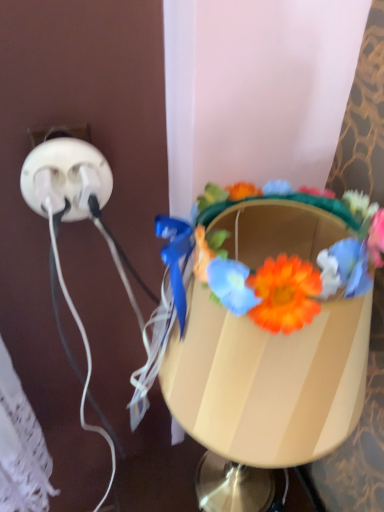
Question: From a real-world perspective, is floral crown at center on top of matte plastic table lamp at center?

Choices:
 (A) yes
 (B) no

Answer: (A)

Question: Considering the relative sizes of floral crown at center and matte plastic table lamp at center in the image provided, is floral crown at center smaller than matte plastic table lamp at center?

Choices:
 (A) no
 (B) yes

Answer: (B)

Question: Is floral crown at center oriented towards matte plastic table lamp at center?

Choices:
 (A) yes
 (B) no

Answer: (A)

Question: Is floral crown at center to the right of matte plastic table lamp at center from the viewer's perspective?

Choices:
 (A) no
 (B) yes

Answer: (B)

Question: Is floral crown at center wider than matte plastic table lamp at center?

Choices:
 (A) no
 (B) yes

Answer: (A)

Question: Is floral crown at center shorter than matte plastic table lamp at center?

Choices:
 (A) no
 (B) yes

Answer: (B)

Question: Is white plastic power plugs at left positioned beyond the bounds of floral crown at center?

Choices:
 (A) yes
 (B) no

Answer: (A)

Question: Can you confirm if white plastic power plugs at left is thinner than floral crown at center?

Choices:
 (A) yes
 (B) no

Answer: (A)

Question: Is white plastic power plugs at left oriented towards floral crown at center?

Choices:
 (A) no
 (B) yes

Answer: (A)

Question: Does white plastic power plugs at left touch floral crown at center?

Choices:
 (A) no
 (B) yes

Answer: (A)

Question: Is white plastic power plugs at left oriented away from floral crown at center?

Choices:
 (A) no
 (B) yes

Answer: (A)

Question: From a real-world perspective, does white plastic power plugs at left stand above floral crown at center?

Choices:
 (A) no
 (B) yes

Answer: (A)

Question: From a real-world perspective, does matte plastic table lamp at center stand above white plastic power plugs at left?

Choices:
 (A) yes
 (B) no

Answer: (B)